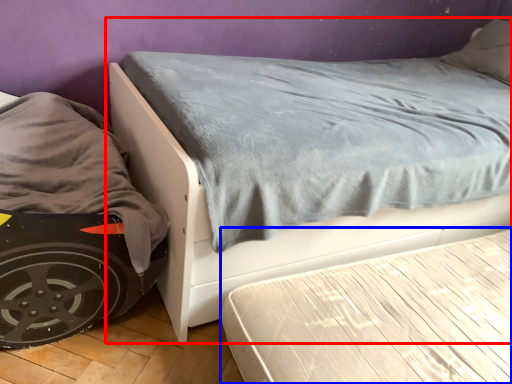
Question: Which of the following is the farthest to the observer, bed (highlighted by a red box) or bed frame (highlighted by a blue box)?

Choices:
 (A) bed
 (B) bed frame

Answer: (B)